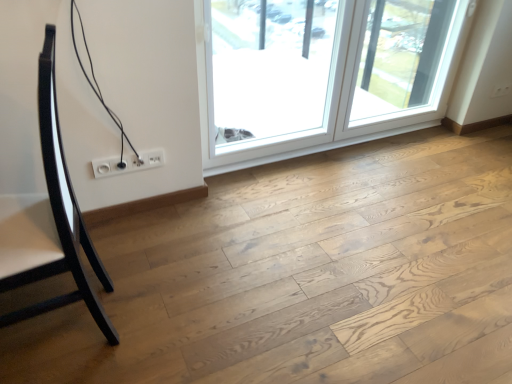
Image resolution: width=512 pixels, height=384 pixels. Describe the element at coordinates (397, 64) in the screenshot. I see `transparent glass screen door at upper right` at that location.

What do you see at coordinates (305, 276) in the screenshot? I see `natural wood floor at center` at bounding box center [305, 276].

Locate an element on the screen. transparent glass window at upper center, acting as the 2th window starting from the right is located at coordinates (269, 70).

You are a GUI agent. You are given a task and a screenshot of the screen. Output one action in this format:
    pyautogui.click(x=<x>, y=<y>)
    Task: Click on the transparent glass screen door at upper right
    
    Given the screenshot: What is the action you would take?
    pyautogui.click(x=397, y=64)

Is transparent glass window at upper right, the 2th window viewed from the left, wider than transparent glass window at upper center, positioned as the first window in left-to-right order?

Indeed, transparent glass window at upper right, the 2th window viewed from the left, has a greater width compared to transparent glass window at upper center, positioned as the first window in left-to-right order.

Considering the points (398, 86) and (239, 143), which point is in front, point (398, 86) or point (239, 143)?

The point (239, 143) is closer.

From the image's perspective, is transparent glass window at upper right, the first window from the right, located above or below transparent glass window at upper center, acting as the 2th window starting from the right?

transparent glass window at upper right, the first window from the right, is situated higher than transparent glass window at upper center, acting as the 2th window starting from the right, in the image.

Find the location of `window that is on the left side of transparent glass window at upper right, the 2th window viewed from the left`. window that is on the left side of transparent glass window at upper right, the 2th window viewed from the left is located at coordinates (269, 70).

Considering the points (276, 112) and (63, 257), which point is behind, point (276, 112) or point (63, 257)?

Point (276, 112)

In terms of size, does transparent glass window at upper center, positioned as the first window in left-to-right order, appear bigger or smaller than glossy black chair at left?

transparent glass window at upper center, positioned as the first window in left-to-right order, is smaller than glossy black chair at left.

Considering the sizes of transparent glass window at upper center, acting as the 2th window starting from the right, and glossy black chair at left in the image, is transparent glass window at upper center, acting as the 2th window starting from the right, taller or shorter than glossy black chair at left?

transparent glass window at upper center, acting as the 2th window starting from the right, is shorter than glossy black chair at left.

Is transparent glass window at upper center, positioned as the first window in left-to-right order, looking in the opposite direction of glossy black chair at left?

No, transparent glass window at upper center, positioned as the first window in left-to-right order, is not facing the opposite direction of glossy black chair at left.

From the image's perspective, is transparent glass window at upper center, acting as the 2th window starting from the right, above or below white plastic socket at lower center?

From the image's perspective, transparent glass window at upper center, acting as the 2th window starting from the right, appears above white plastic socket at lower center.

Which is in front, transparent glass window at upper center, acting as the 2th window starting from the right, or white plastic socket at lower center?

transparent glass window at upper center, acting as the 2th window starting from the right, is in front.

Which point is more distant from viewer, (241,66) or (157,159)?

Positioned behind is point (241,66).

Is transparent glass window at upper center, positioned as the first window in left-to-right order, situated inside white plastic socket at lower center or outside?

transparent glass window at upper center, positioned as the first window in left-to-right order, is located beyond the bounds of white plastic socket at lower center.

From the image's perspective, is transparent glass screen door at upper right above or below transparent glass window at upper right, the 2th window viewed from the left?

transparent glass screen door at upper right is above transparent glass window at upper right, the 2th window viewed from the left.

Is transparent glass screen door at upper right in front of transparent glass window at upper right, the 2th window viewed from the left?

No, transparent glass screen door at upper right is further to the viewer.

Considering the positions of objects transparent glass screen door at upper right and transparent glass window at upper right, the 2th window viewed from the left, in the image provided, who is more to the right, transparent glass screen door at upper right or transparent glass window at upper right, the 2th window viewed from the left,?

Positioned to the right is transparent glass screen door at upper right.

Which is in front, point (369, 22) or point (328, 39)?

The point (369, 22) is closer.

How far apart are transparent glass window at upper center, acting as the 2th window starting from the right, and transparent glass screen door at upper right?

transparent glass window at upper center, acting as the 2th window starting from the right, and transparent glass screen door at upper right are 28.77 inches apart.

Considering the sizes of transparent glass window at upper center, acting as the 2th window starting from the right, and transparent glass screen door at upper right in the image, is transparent glass window at upper center, acting as the 2th window starting from the right, wider or thinner than transparent glass screen door at upper right?

transparent glass window at upper center, acting as the 2th window starting from the right, is thinner than transparent glass screen door at upper right.

Is transparent glass screen door at upper right located within transparent glass window at upper center, acting as the 2th window starting from the right?

Definitely not — transparent glass screen door at upper right is not inside transparent glass window at upper center, acting as the 2th window starting from the right.

Does glossy black chair at left turn towards transparent glass window at upper center, positioned as the first window in left-to-right order?

No.

Which object is further away from the camera, glossy black chair at left or transparent glass window at upper center, positioned as the first window in left-to-right order?

transparent glass window at upper center, positioned as the first window in left-to-right order, is more distant.

How many degrees apart are the facing directions of glossy black chair at left and transparent glass window at upper center, acting as the 2th window starting from the right?

The angle between the facing direction of glossy black chair at left and the facing direction of transparent glass window at upper center, acting as the 2th window starting from the right, is 95.8 degrees.

From the picture: Is glossy black chair at left with transparent glass window at upper center, acting as the 2th window starting from the right?

There is a gap between glossy black chair at left and transparent glass window at upper center, acting as the 2th window starting from the right.

Considering the relative positions of white plastic socket at lower center and transparent glass window at upper right, the first window from the right, in the image provided, is white plastic socket at lower center to the left of transparent glass window at upper right, the first window from the right, from the viewer's perspective?

Yes.

Who is smaller, white plastic socket at lower center or transparent glass window at upper right, the first window from the right?

Smaller between the two is white plastic socket at lower center.

From a real-world perspective, who is located lower, white plastic socket at lower center or transparent glass window at upper right, the 2th window viewed from the left?

In real-world perspective, white plastic socket at lower center is lower.

Considering the positions of points (103, 166) and (278, 3), is point (103, 166) farther from camera compared to point (278, 3)?

That is False.

Locate an element on the screen. This screenshot has width=512, height=384. window on the right of transparent glass window at upper center, positioned as the first window in left-to-right order is located at coordinates (321, 74).

This screenshot has height=384, width=512. I want to click on furniture below the transparent glass window at upper center, positioned as the first window in left-to-right order (from the image's perspective), so click(54, 220).

From the image, which object appears to be farther from white plastic socket at lower center, natural wood floor at center or glossy black chair at left?

The object further to white plastic socket at lower center is natural wood floor at center.

Considering their positions, is glossy black chair at left positioned closer to transparent glass screen door at upper right than transparent glass window at upper right, the 2th window viewed from the left?

transparent glass window at upper right, the 2th window viewed from the left, is closer to transparent glass screen door at upper right.

Looking at the image, which one is located closer to transparent glass window at upper right, the 2th window viewed from the left, natural wood floor at center or transparent glass screen door at upper right?

The object closer to transparent glass window at upper right, the 2th window viewed from the left, is transparent glass screen door at upper right.

In the scene shown: When comparing their distances from transparent glass screen door at upper right, does glossy black chair at left or transparent glass window at upper center, acting as the 2th window starting from the right, seem further?

Based on the image, glossy black chair at left appears to be further to transparent glass screen door at upper right.

Estimate the real-world distances between objects in this image. Which object is closer to transparent glass window at upper right, the first window from the right, transparent glass window at upper center, acting as the 2th window starting from the right, or natural wood floor at center?

The object closer to transparent glass window at upper right, the first window from the right, is transparent glass window at upper center, acting as the 2th window starting from the right.

Based on their spatial positions, is white plastic socket at lower center or transparent glass window at upper center, acting as the 2th window starting from the right, further from transparent glass screen door at upper right?

The object further to transparent glass screen door at upper right is white plastic socket at lower center.

In the scene shown: Based on their spatial positions, is transparent glass screen door at upper right or natural wood floor at center closer to glossy black chair at left?

The object closer to glossy black chair at left is natural wood floor at center.

Considering their positions, is natural wood floor at center positioned closer to transparent glass screen door at upper right than white plastic socket at lower center?

natural wood floor at center is positioned closer to the anchor transparent glass screen door at upper right.

Locate an element on the screen. The width and height of the screenshot is (512, 384). window situated between transparent glass window at upper center, acting as the 2th window starting from the right, and transparent glass screen door at upper right from left to right is located at coordinates (321, 74).

Identify the location of electric outlet located between glossy black chair at left and transparent glass screen door at upper right in the left-right direction. (127, 163).

At what (x,y) coordinates should I click in order to perform the action: click on window positioned between glossy black chair at left and transparent glass window at upper right, the first window from the right, from near to far. Please return your answer as a coordinate pair (x, y). Looking at the image, I should click on (269, 70).

I want to click on electric outlet located between glossy black chair at left and natural wood floor at center in the left-right direction, so click(x=127, y=163).